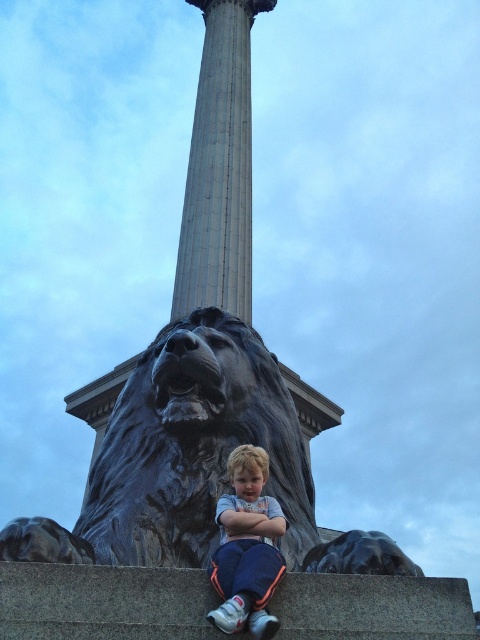
You are a GUI agent. You are given a task and a screenshot of the screen. Output one action in this format:
    pyautogui.click(x=<x>, y=<y>)
    Task: Click on the polished bronze lion at center
    
    Given the screenshot: What is the action you would take?
    pyautogui.click(x=192, y=445)

Which is above, polished bronze lion at center or gray marble column at center?

gray marble column at center is above.

Who is more distant from viewer, (96, 493) or (226, 19)?

Positioned behind is point (226, 19).

What are the coordinates of `polished bronze lion at center` in the screenshot? It's located at (192, 445).

Find the location of a particular element. polished bronze lion at center is located at coordinates point(192,445).

Is point (109, 548) more distant than point (242, 604)?

Yes.

Where is `polished bronze lion at center`? Image resolution: width=480 pixels, height=640 pixels. polished bronze lion at center is located at coordinates (192, 445).

Does point (236, 36) lie behind point (248, 486)?

Yes, point (236, 36) is farther from viewer.

Does gray marble column at center appear on the right side of light blue t-shirt at center?

No, gray marble column at center is not to the right of light blue t-shirt at center.

Where is `gray marble column at center`? This screenshot has width=480, height=640. gray marble column at center is located at coordinates (219, 168).

This screenshot has width=480, height=640. I want to click on gray marble column at center, so 219,168.